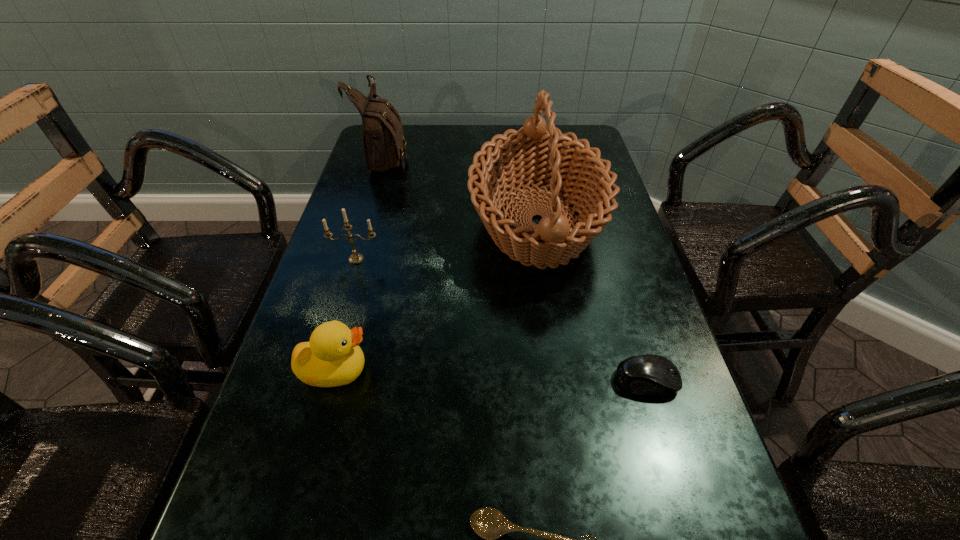
Find the location of a particular element. object that is the fourth closest one to the fifth shortest object is located at coordinates (646, 374).

Choose which object is the nearest neighbor to the nearest object. Please provide its 2D coordinates. Your answer should be formatted as a tuple, i.e. [(x, y)], where the tuple contains the x and y coordinates of a point satisfying the conditions above.

[(646, 374)]

What are the coordinates of `free point that satisfies the following two spatial constraints: 1. on the front-facing side of the shoulder bag; 2. on the back side of the second shortest object` in the screenshot? It's located at (320, 381).

Where is `vacant space that satisfies the following two spatial constraints: 1. at the beak of the mouse; 2. on the right side of the third shortest object`? The height and width of the screenshot is (540, 960). vacant space that satisfies the following two spatial constraints: 1. at the beak of the mouse; 2. on the right side of the third shortest object is located at coordinates (332, 381).

Find the location of a particular element. The height and width of the screenshot is (540, 960). vacant space that satisfies the following two spatial constraints: 1. on the front-facing side of the tallest object; 2. on the right side of the shoulder bag is located at coordinates (366, 222).